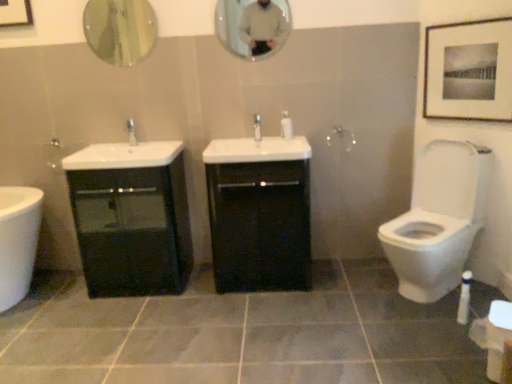
Where is `vacant area that lies between black glossy cabinet at center, which is counted as the 2th bathroom cabinet, starting from the left, and black glossy cabinet at left, which appears as the second bathroom cabinet when viewed from the right`? The width and height of the screenshot is (512, 384). vacant area that lies between black glossy cabinet at center, which is counted as the 2th bathroom cabinet, starting from the left, and black glossy cabinet at left, which appears as the second bathroom cabinet when viewed from the right is located at coordinates (201, 284).